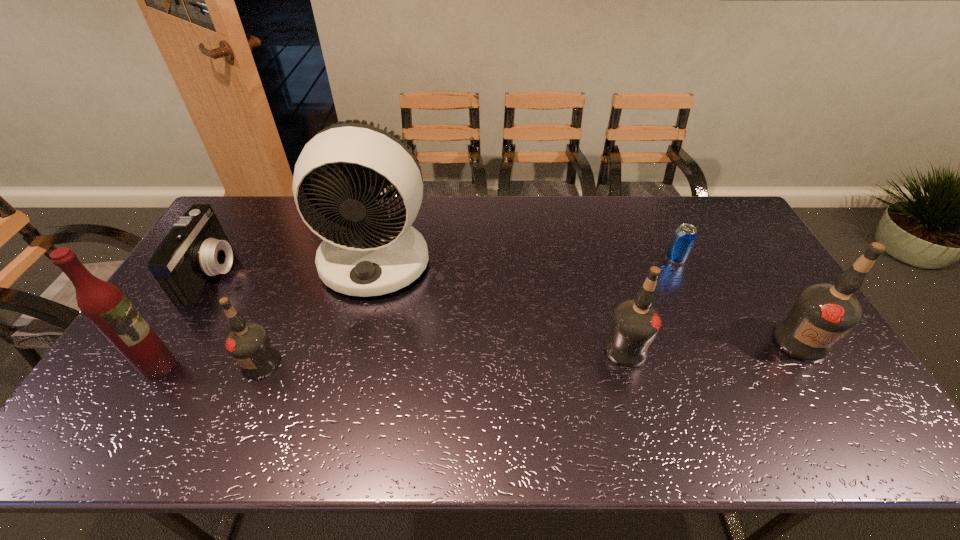
This screenshot has width=960, height=540. Identify the location of the fifth object from right to left. (248, 343).

At what (x,y) coordinates should I click in order to perform the action: click on the leftmost vodka. Please return your answer as a coordinate pair (x, y). This screenshot has height=540, width=960. Looking at the image, I should click on (248, 343).

The height and width of the screenshot is (540, 960). Find the location of `the third object from right to left`. the third object from right to left is located at coordinates (635, 323).

You are a GUI agent. You are given a task and a screenshot of the screen. Output one action in this format:
    pyautogui.click(x=<x>, y=<y>)
    Task: Click on the second vodka from left to right
    The image size is (960, 540).
    Given the screenshot: What is the action you would take?
    pyautogui.click(x=635, y=323)

What are the coordinates of `the rightmost object` in the screenshot? It's located at (822, 313).

You are a GUI agent. You are given a task and a screenshot of the screen. Output one action in this format:
    pyautogui.click(x=<x>, y=<y>)
    Task: Click on the camcorder
    The width and height of the screenshot is (960, 540).
    Given the screenshot: What is the action you would take?
    pyautogui.click(x=196, y=248)

Locate an element on the screen. The width and height of the screenshot is (960, 540). beer can is located at coordinates (685, 235).

This screenshot has height=540, width=960. What are the coordinates of `the shortest object` in the screenshot? It's located at (685, 235).

Locate an element on the screen. The image size is (960, 540). the fourth object from right to left is located at coordinates (365, 252).

This screenshot has height=540, width=960. Identify the location of liquor. (104, 304).